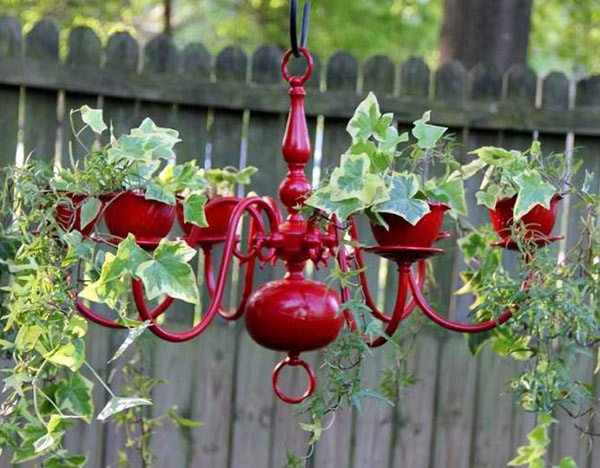
The image size is (600, 468). In order to click on plant in this screenshot , I will do `click(152, 182)`.